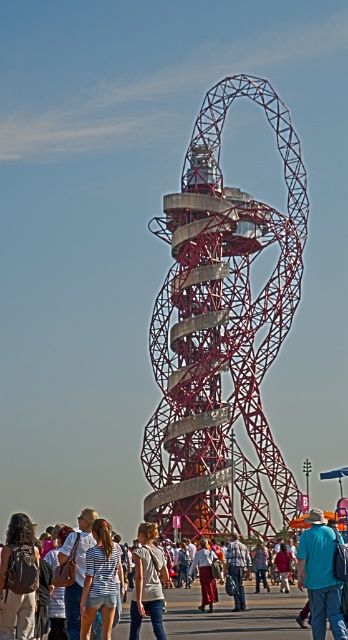
Question: Which point is closer to the camera?

Choices:
 (A) dark brown backpack at lower left
 (B) striped cotton shirt at center
 (C) denim shorts at center
 (D) metallic red sculpture at center

Answer: (B)

Question: Is metallic red sculpture at center to the left of striped cotton shirt at center from the viewer's perspective?

Choices:
 (A) no
 (B) yes

Answer: (A)

Question: Which of the following is the farthest from the observer?

Choices:
 (A) (154, 573)
 (B) (8, 605)
 (C) (154, 333)
 (D) (200, 577)

Answer: (C)

Question: Considering the relative positions of metallic red sculpture at center and striped cotton shirt at center in the image provided, where is metallic red sculpture at center located with respect to striped cotton shirt at center?

Choices:
 (A) right
 (B) left

Answer: (A)

Question: Does metallic red sculpture at center appear over light gray cotton shirt at lower center?

Choices:
 (A) yes
 (B) no

Answer: (A)

Question: Which point is closer to the camera?

Choices:
 (A) (263, 365)
 (B) (164, 561)

Answer: (B)